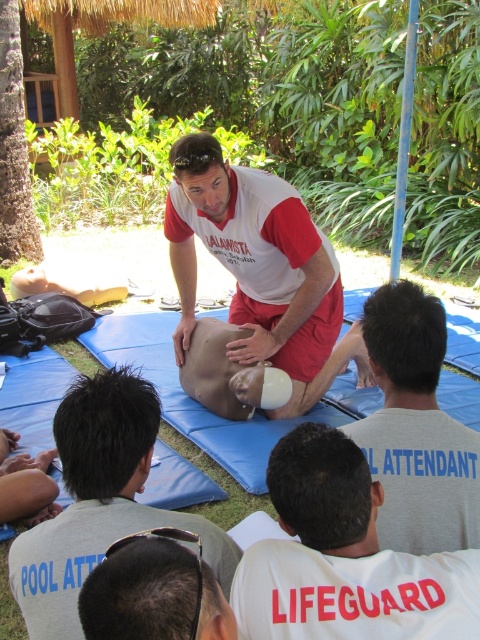
Who is positioned more to the left, matte white torso at center or gray matte lifeguard shirt at center?

From the viewer's perspective, matte white torso at center appears more on the left side.

In the scene shown: Is matte white torso at center above gray matte lifeguard shirt at center?

No.

Where is `matte white torso at center`? The width and height of the screenshot is (480, 640). matte white torso at center is located at coordinates (99, 500).

Who is taller, white cotton shirt at center or white/red material/texture shirt at center?

white/red material/texture shirt at center

Is point (288, 600) closer to viewer compared to point (190, 221)?

Yes.

Image resolution: width=480 pixels, height=640 pixels. Identify the location of white cotton shirt at center. (344, 557).

Who is more distant from viewer, [310,349] or [155,422]?

The point [310,349] is behind.

Identify the location of white/red material/texture shirt at center. (261, 269).

Does point (253, 355) come farther from viewer compared to point (46, 593)?

Yes, it is.

At what (x,y) coordinates should I click in order to perform the action: click on white/red material/texture shirt at center. Please return your answer as a coordinate pair (x, y). This screenshot has height=640, width=480. Looking at the image, I should click on (261, 269).